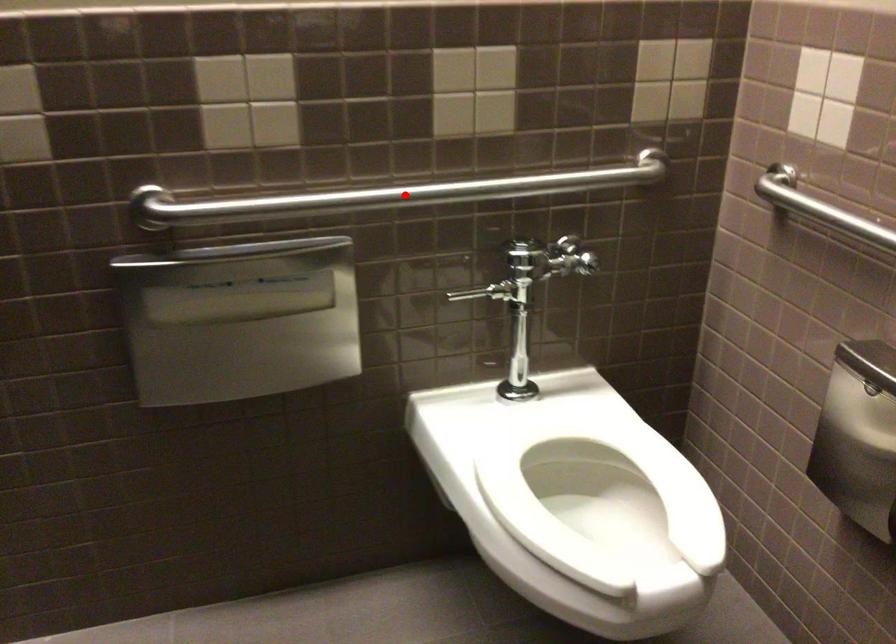
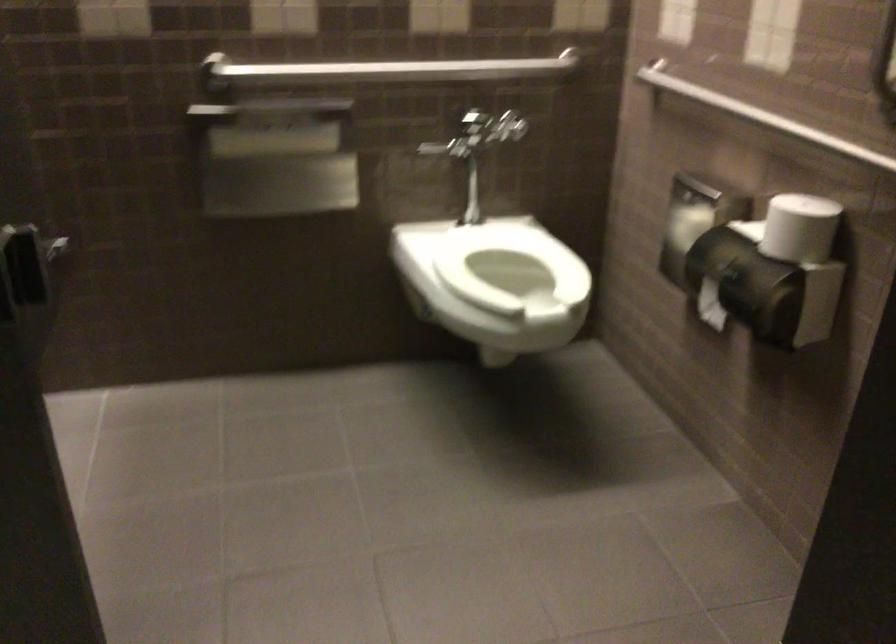
Locate, in the second image, the point that corresponds to the highlighted location in the first image.

(391, 69)